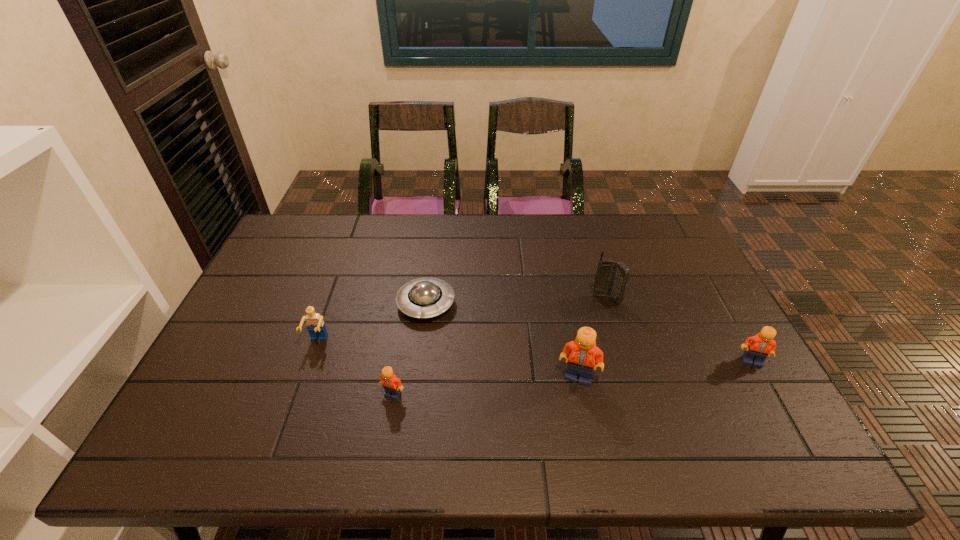
Select which Lego appears as the third closest to the leftmost object. Please provide its 2D coordinates. Your answer should be formatted as a tuple, i.e. [(x, y)], where the tuple contains the x and y coordinates of a point satisfying the conditions above.

[(758, 347)]

Find the location of a particular element. Lego that is the closest to the shortest object is located at coordinates (315, 325).